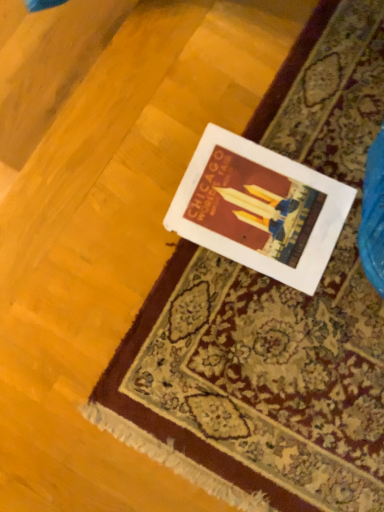
Locate an element on the screen. empty space that is ontop of matte paper book at center (from a real-world perspective) is located at coordinates (261, 207).